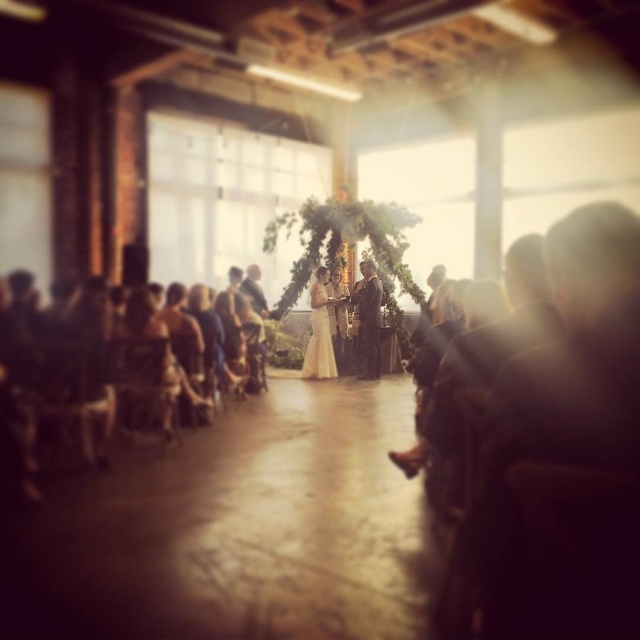
You are a photographer setting up equipment for the wedding ceremony. You have a long, narrow camera stand that needs to be placed on either the smooth wooden floor at center or the wooden chair at left. Which surface can accommodate the camera stand better based on their dimensions?

The smooth wooden floor at center is thinner than the wooden chair at left, so the camera stand would fit better on the wooden chair at left since it has a wider surface area.

You are a photographer at the wedding ceremony and need to position yourself between the smooth wooden floor at center and the wooden chair at left. Which object should you stand closer to if you want to be nearer to the couple standing at the podium?

You should stand closer to the smooth wooden floor at center because it is positioned to the right of the wooden chair at left, and the couple is at the center of the image near the podium.